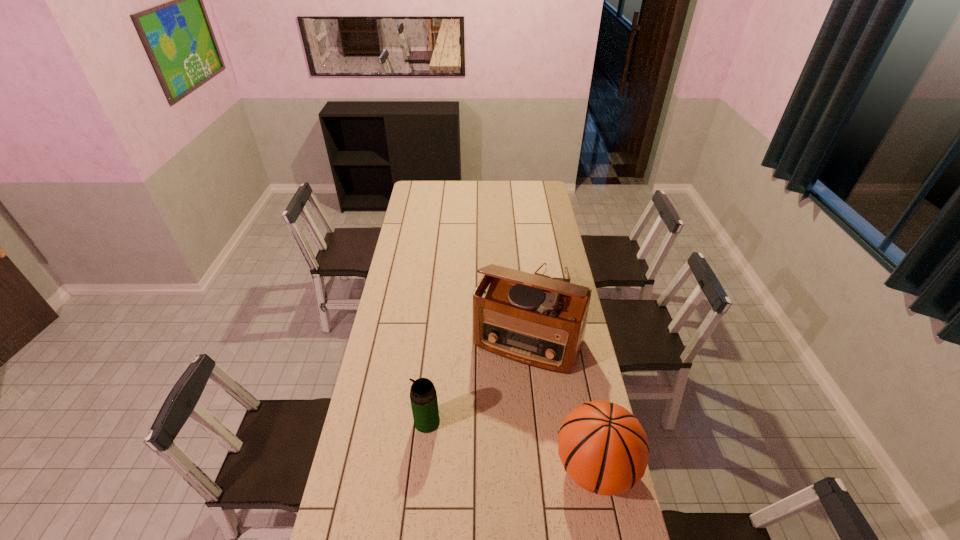
This screenshot has height=540, width=960. Identify the location of object located at the near right corner. (603, 448).

You are a GUI agent. You are given a task and a screenshot of the screen. Output one action in this format:
    pyautogui.click(x=<x>, y=<y>)
    Task: Click on the vacant space at the far edge of the desktop
    
    Given the screenshot: What is the action you would take?
    pyautogui.click(x=482, y=180)

Locate an element on the screen. free space at the near edge is located at coordinates (572, 529).

Locate an element on the screen. The image size is (960, 540). vacant space at the left edge is located at coordinates (404, 369).

Locate an element on the screen. vacant area at the right edge of the desktop is located at coordinates (585, 496).

Image resolution: width=960 pixels, height=540 pixels. Identify the location of free space between the thermos bottle and the radio receiver. (477, 381).

Locate an element on the screen. This screenshot has height=540, width=960. empty location between the second farthest object and the basketball is located at coordinates (562, 404).

Identify the location of vacant area that lies between the tallest object and the basketball. (562, 404).

I want to click on free space between the basketball and the radio receiver, so click(x=562, y=404).

In order to click on vacant region between the second farthest object and the thermos bottle in this screenshot , I will do [x=477, y=381].